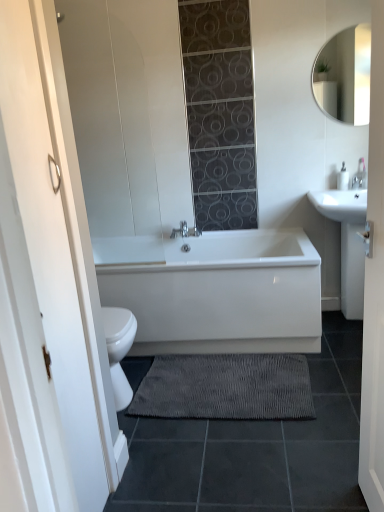
Question: Is gray textured bath mat at lower center bigger or smaller than white matte glass door at left?

Choices:
 (A) small
 (B) big

Answer: (A)

Question: From the image's perspective, is gray textured bath mat at lower center located above or below white matte glass door at left?

Choices:
 (A) below
 (B) above

Answer: (A)

Question: Which object is positioned closest to the white matte glass door at left?

Choices:
 (A) white glossy mirror at upper right
 (B) white glossy bathtub at center
 (C) white glossy sink at right
 (D) gray textured bath mat at lower center
 (E) white wooden door at center

Answer: (B)

Question: Based on their relative distances, which object is nearer to the white wooden door at center?

Choices:
 (A) white glossy bathtub at center
 (B) gray textured bath mat at lower center
 (C) white glossy sink at right
 (D) white glossy mirror at upper right
 (E) white matte glass door at left

Answer: (B)